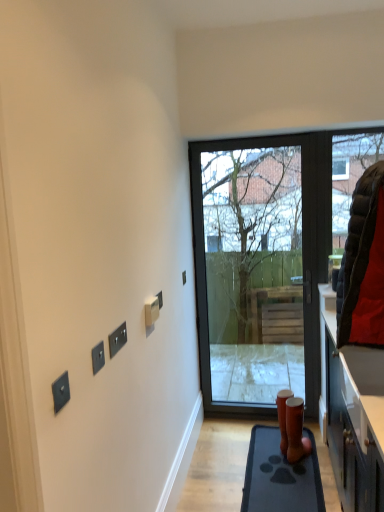
Locate an element on the screen. free spot above rubber mat at lower right (from a real-world perspective) is located at coordinates (289, 469).